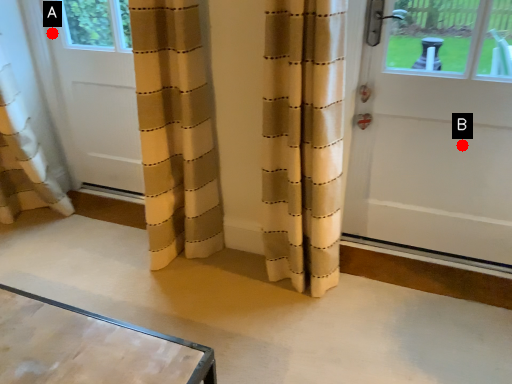
Question: Two points are circled on the image, labeled by A and B beside each circle. Which point appears farthest from the camera in this image?

Choices:
 (A) A is further
 (B) B is further

Answer: (A)